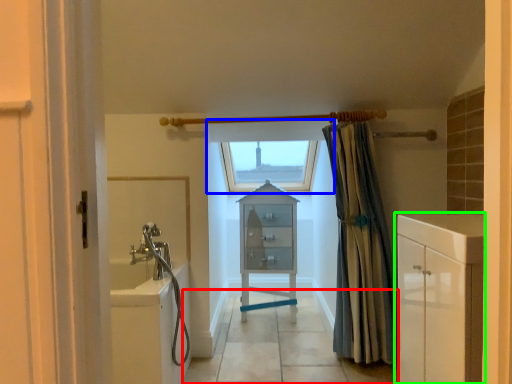
Question: Which object is positioned farthest from path (highlighted by a red box)? Select from window (highlighted by a blue box) and bathroom cabinet (highlighted by a green box).

Choices:
 (A) window
 (B) bathroom cabinet

Answer: (A)